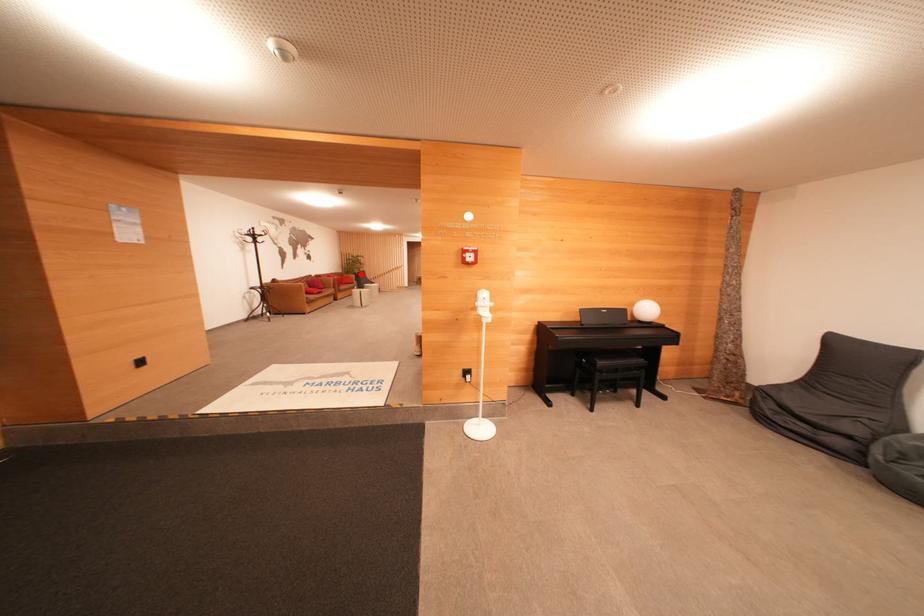
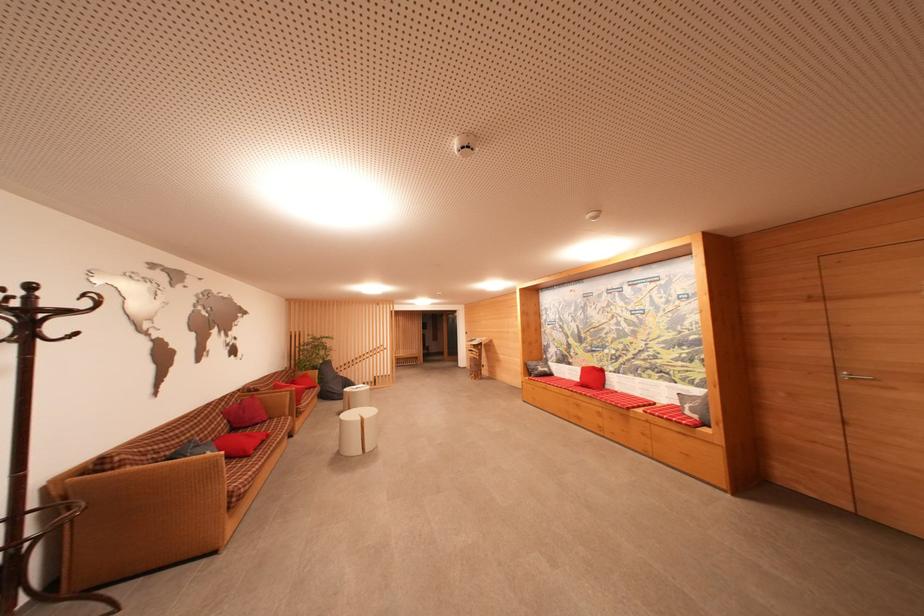
Find the pixel in the second image that matches the highlighted location in the first image.

(323, 365)